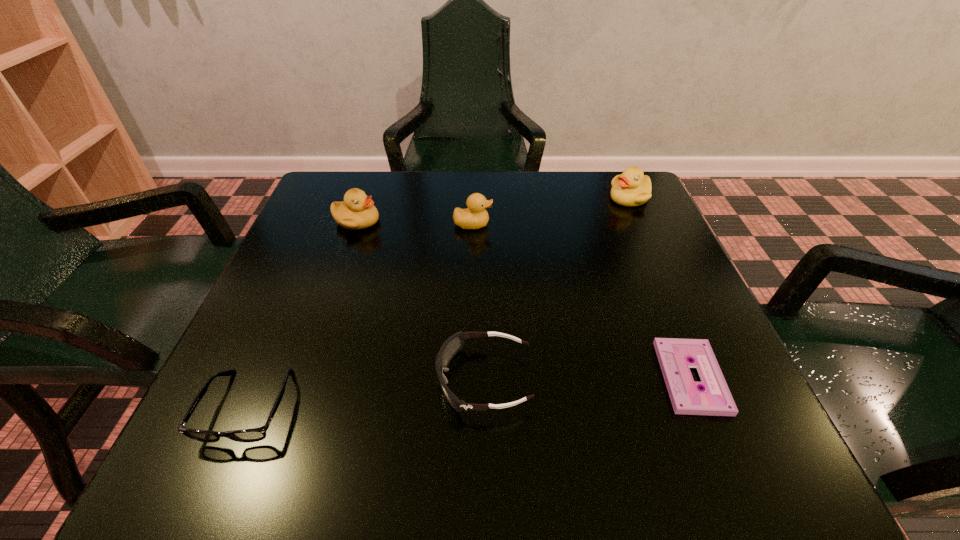
Find the location of `vacant space located 0.200m on the face of the second duckling from right to left`. vacant space located 0.200m on the face of the second duckling from right to left is located at coordinates (580, 224).

Find the location of `free space located on the front and sides of the goggles`. free space located on the front and sides of the goggles is located at coordinates (319, 380).

Find the location of a particular element. Image resolution: width=960 pixels, height=540 pixels. vacant space located 0.080m on the front and sides of the goggles is located at coordinates 387,380.

What are the coordinates of `free space located on the front and sides of the goggles` in the screenshot? It's located at (369, 380).

The width and height of the screenshot is (960, 540). In order to click on vacant space located 0.250m on the left of the shortest object in this screenshot , I will do `click(505, 377)`.

Image resolution: width=960 pixels, height=540 pixels. Identify the location of goggles that is at the near edge. (453, 344).

Find the location of `spectacles situated at the near edge`. spectacles situated at the near edge is located at coordinates (255, 434).

Where is `duckling present at the left edge`? The width and height of the screenshot is (960, 540). duckling present at the left edge is located at coordinates (357, 211).

Where is `spectacles located in the left edge section of the desktop`? The width and height of the screenshot is (960, 540). spectacles located in the left edge section of the desktop is located at coordinates (255, 434).

Where is `duckling that is positioned at the right edge`? This screenshot has width=960, height=540. duckling that is positioned at the right edge is located at coordinates (632, 188).